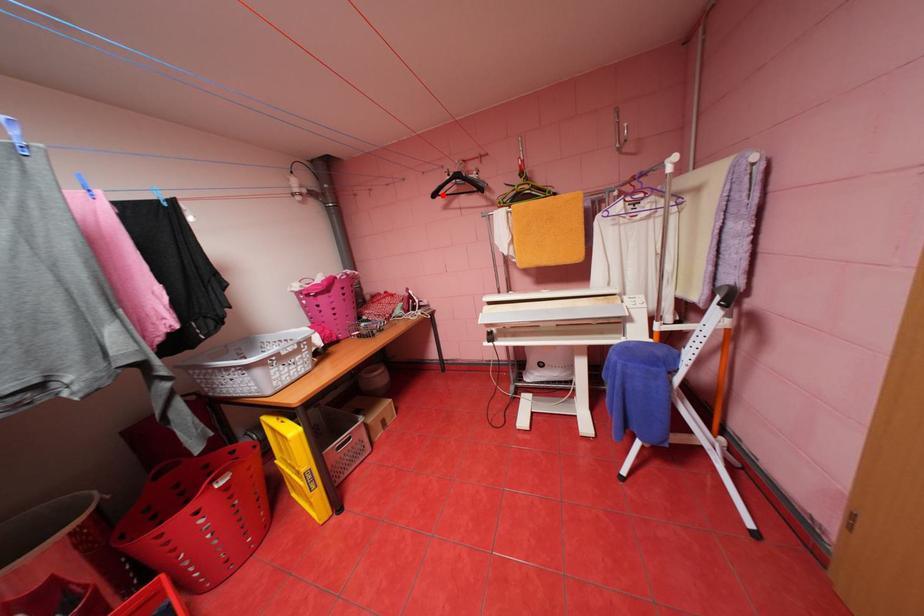
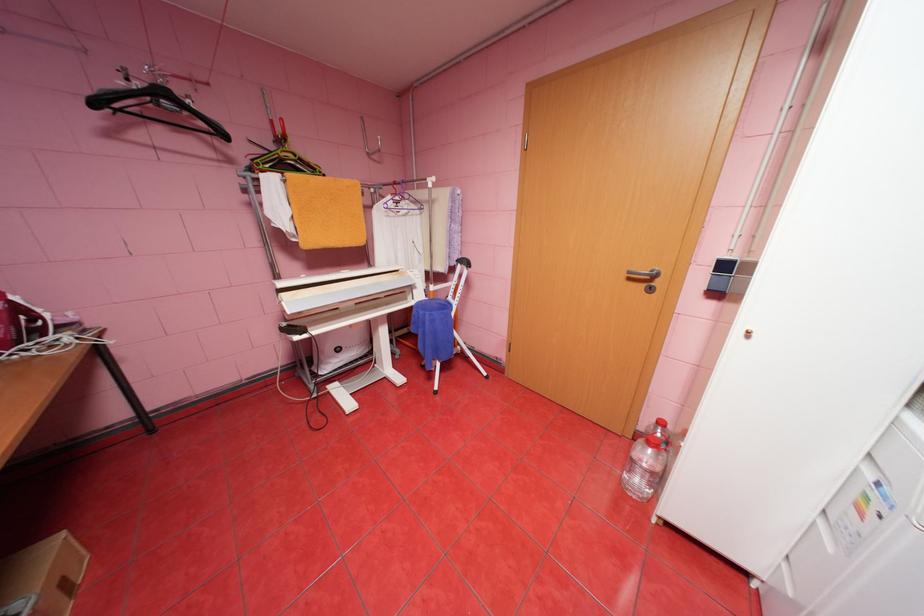
In the second image, find the point that corresponds to the highlighted location in the first image.

(103, 103)